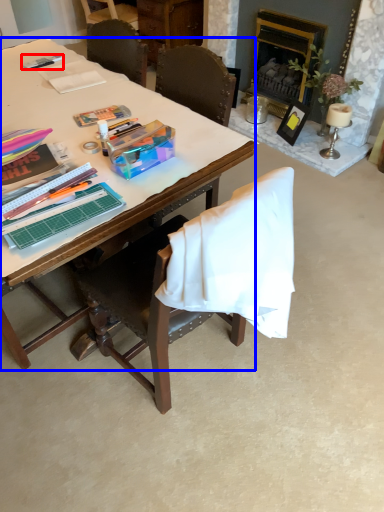
Question: Which point is closer to the camera, pen (highlighted by a red box) or desk (highlighted by a blue box)?

Choices:
 (A) pen
 (B) desk

Answer: (B)